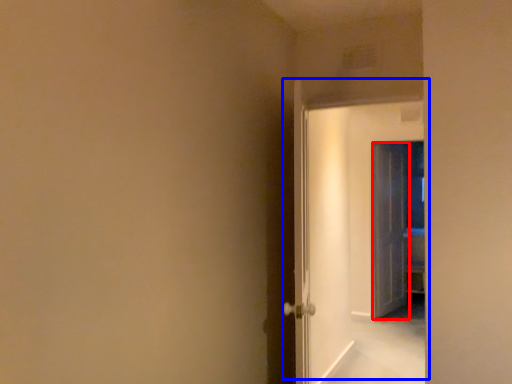
Question: Which point is further to the camera, door (highlighted by a red box) or door (highlighted by a blue box)?

Choices:
 (A) door
 (B) door

Answer: (A)